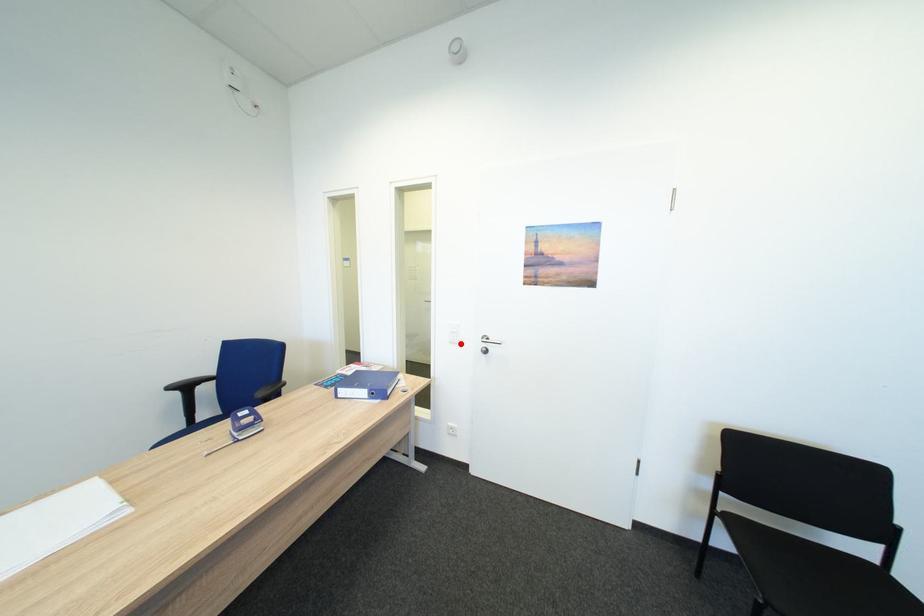
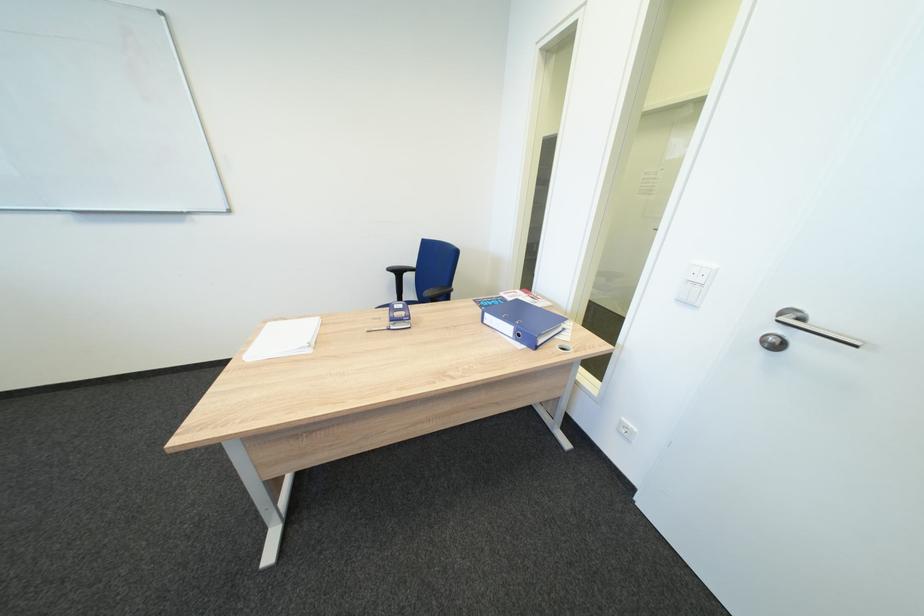
In the second image, find the point that corresponds to the highlighted location in the first image.

(687, 302)